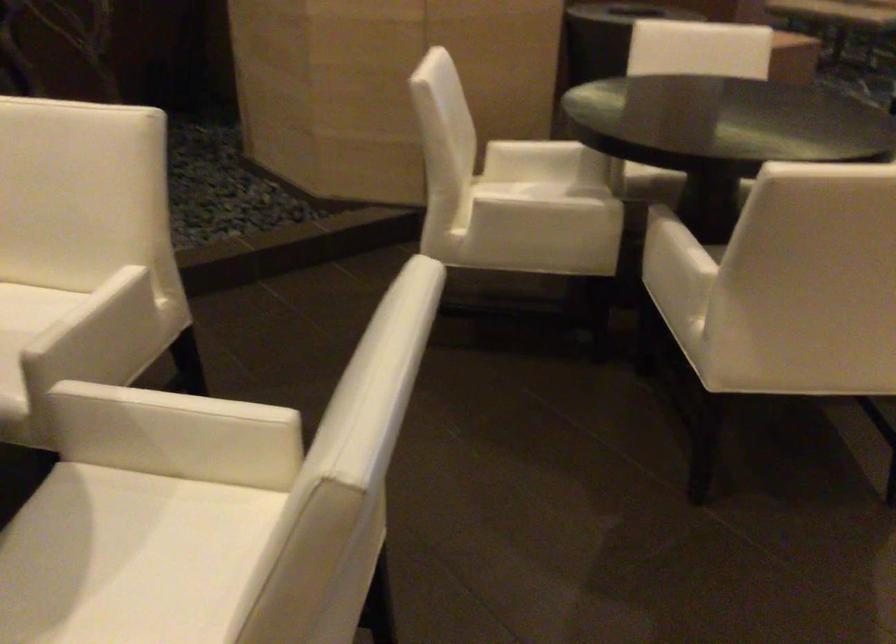
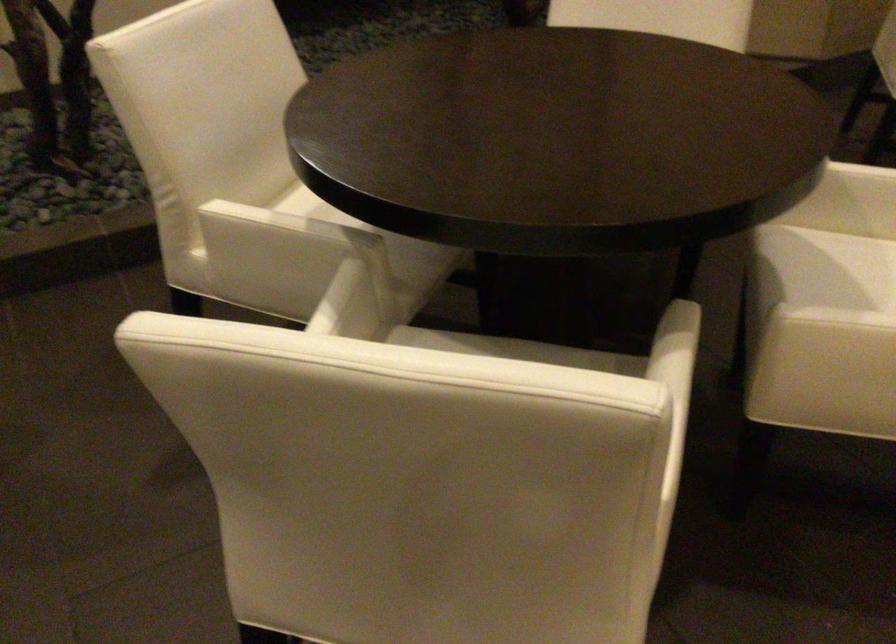
The point at (96, 536) is marked in the first image. Where is the corresponding point in the second image?

(855, 266)